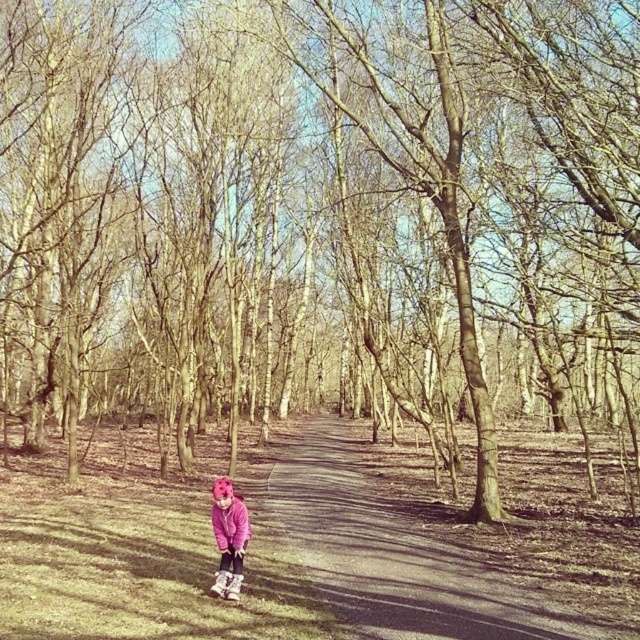
You are a photographer standing on the dirt path in the forest and want to take a photo of two points marked in the scene. The points are labeled as point 1 at coordinates point [308,570] and point 2 at coordinates point [237,525]. Which point should you focus on first to ensure both are in sharp focus?

You should focus on point 1 at coordinates point [308,570] first because it is closer to the camera than point 2 at coordinates point [237,525]. This ensures that both points will be in focus when using proper depth of field settings.

You are a photographer standing in the forest scene. You want to take a photo where the brown dirt path at center is in focus while keeping the pink fleece sweatshirt at center somewhat blurry in the background. Is this possible with your current camera settings?

Yes, since the brown dirt path at center is closer to the viewer than the pink fleece sweatshirt at center, adjusting the camera focus to the path and using a shallow depth of field will keep the sweatshirt blurry in the background.